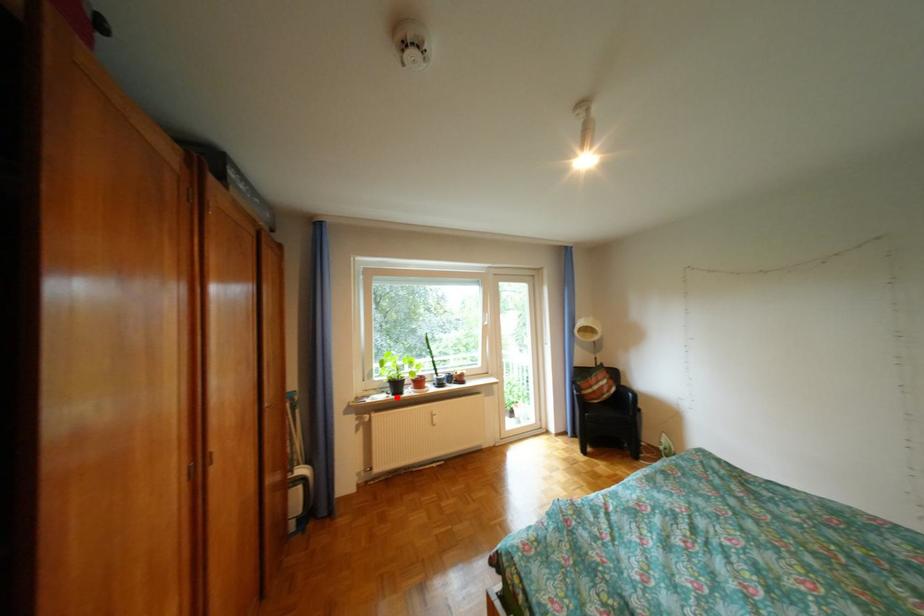
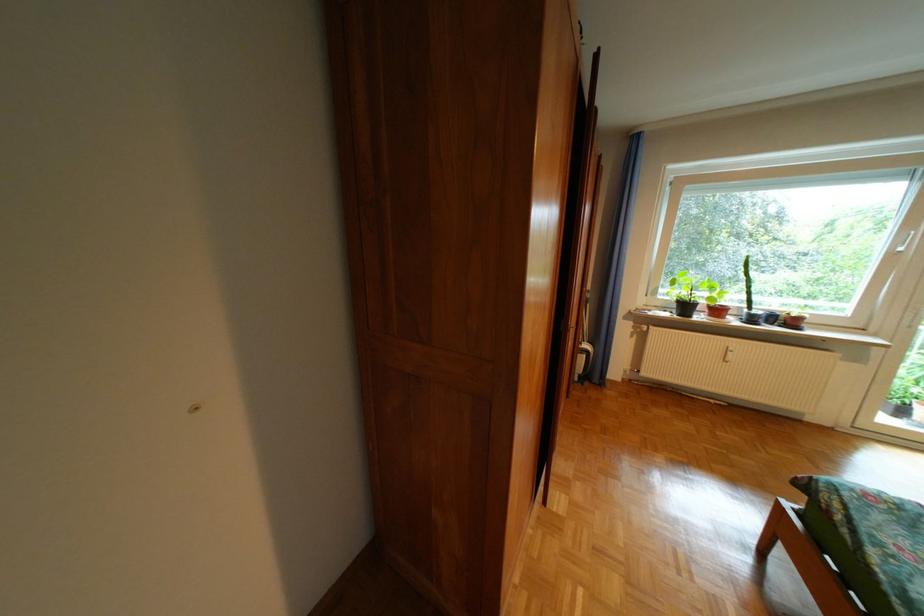
The point at the highlighted location is marked in the first image. Where is the corresponding point in the second image?

(679, 315)